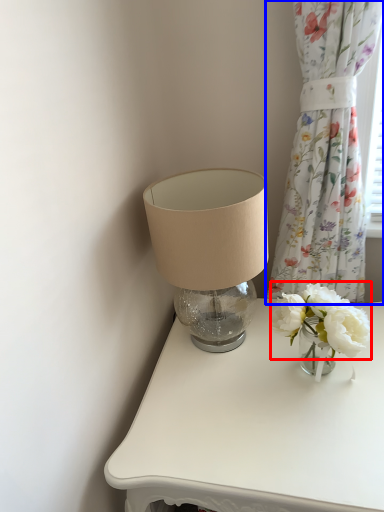
Question: Which point is further to the camera, flower (highlighted by a red box) or curtain (highlighted by a blue box)?

Choices:
 (A) flower
 (B) curtain

Answer: (A)